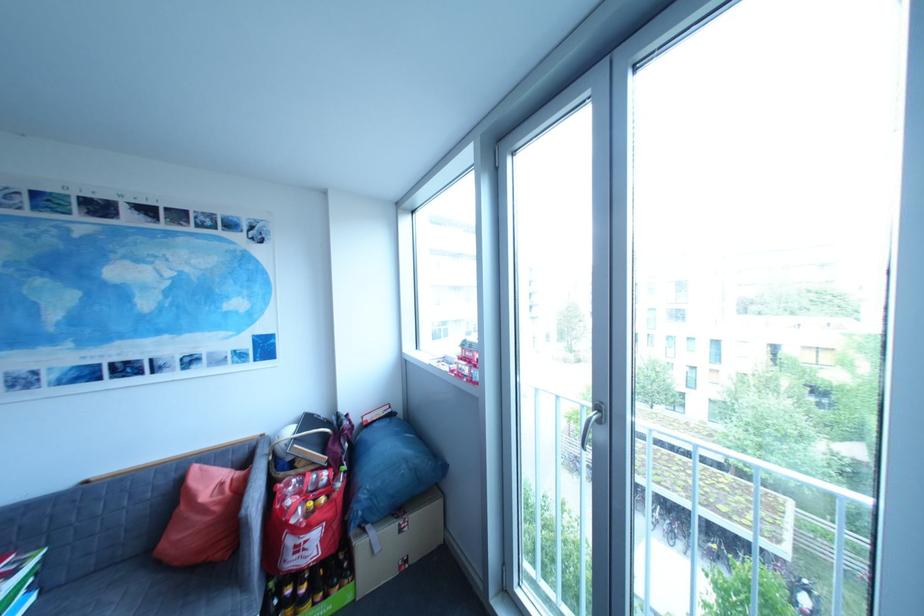
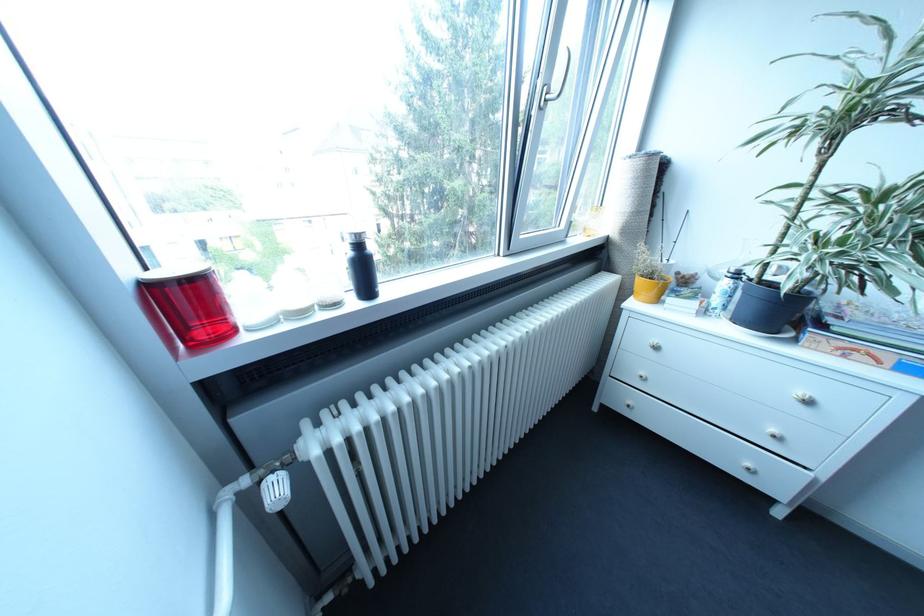
Based on the photo, based on the continuous images, in which direction is the camera rotating?

The camera's rotation is toward right-down.